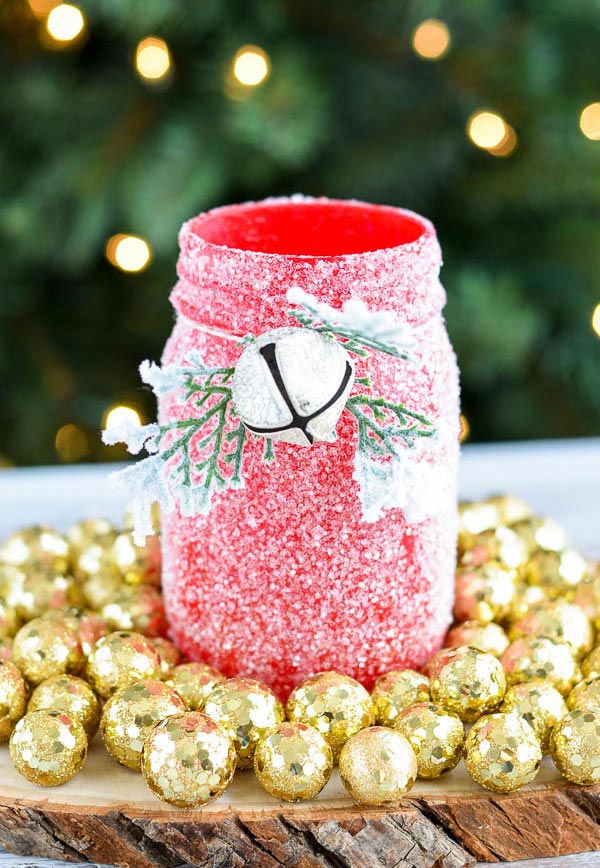
Locate an element on the screen. Image resolution: width=600 pixels, height=868 pixels. rustic round wooden plate with tree bark is located at coordinates (15, 826).